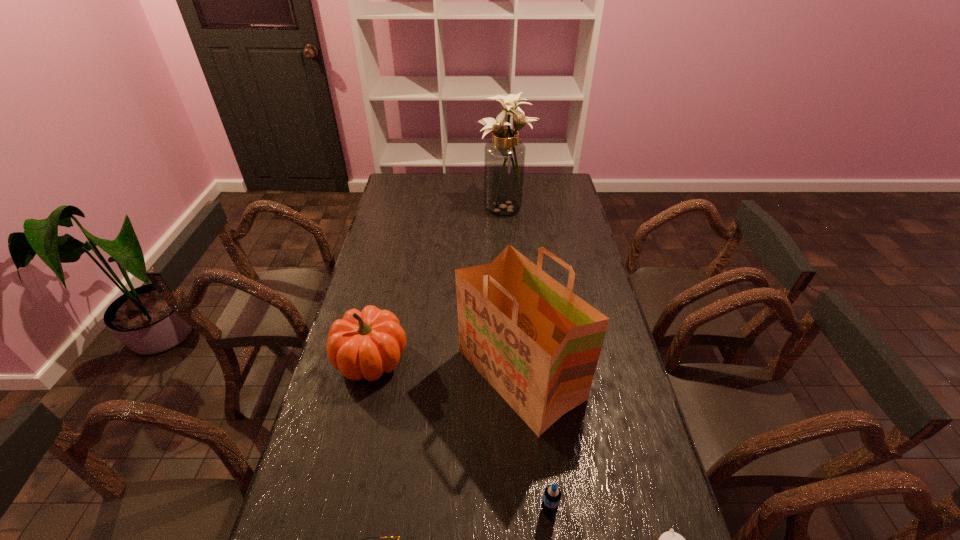
Where is `the farthest object`? Image resolution: width=960 pixels, height=540 pixels. the farthest object is located at coordinates (504, 156).

Image resolution: width=960 pixels, height=540 pixels. What are the coordinates of `the tallest object` in the screenshot? It's located at (504, 156).

Identify the location of the second tallest object. Image resolution: width=960 pixels, height=540 pixels. click(537, 343).

This screenshot has height=540, width=960. Identify the location of the third tallest object. (365, 344).

I want to click on the fourth farthest object, so click(552, 494).

The width and height of the screenshot is (960, 540). Find the location of `free space located on the back of the flower arrangement`. free space located on the back of the flower arrangement is located at coordinates (503, 177).

Image resolution: width=960 pixels, height=540 pixels. Find the location of `vacant position located 0.060m on the back of the fifth shortest object`. vacant position located 0.060m on the back of the fifth shortest object is located at coordinates (515, 312).

At what (x,y) coordinates should I click in order to perform the action: click on free space located 0.400m on the front of the pumpkin. Please return your answer as a coordinate pair (x, y). Looking at the image, I should click on (330, 537).

Find the location of a particular element. The image size is (960, 540). vacant region located 0.360m on the left of the fourth farthest object is located at coordinates (391, 510).

Locate an element on the screen. The width and height of the screenshot is (960, 540). object located in the far edge section of the desktop is located at coordinates (504, 156).